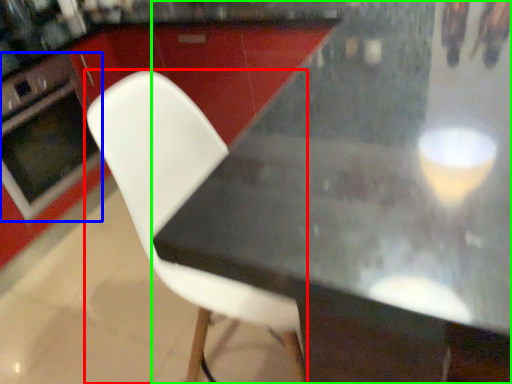
Question: Which object is the farthest from chair (highlighted by a red box)? Choose among these: oven (highlighted by a blue box) or table (highlighted by a green box).

Choices:
 (A) oven
 (B) table

Answer: (A)